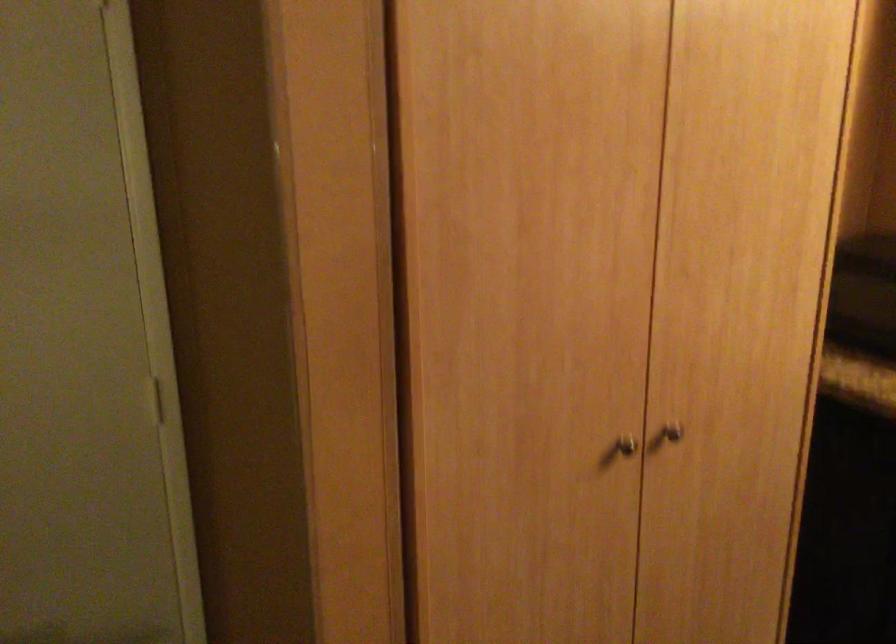
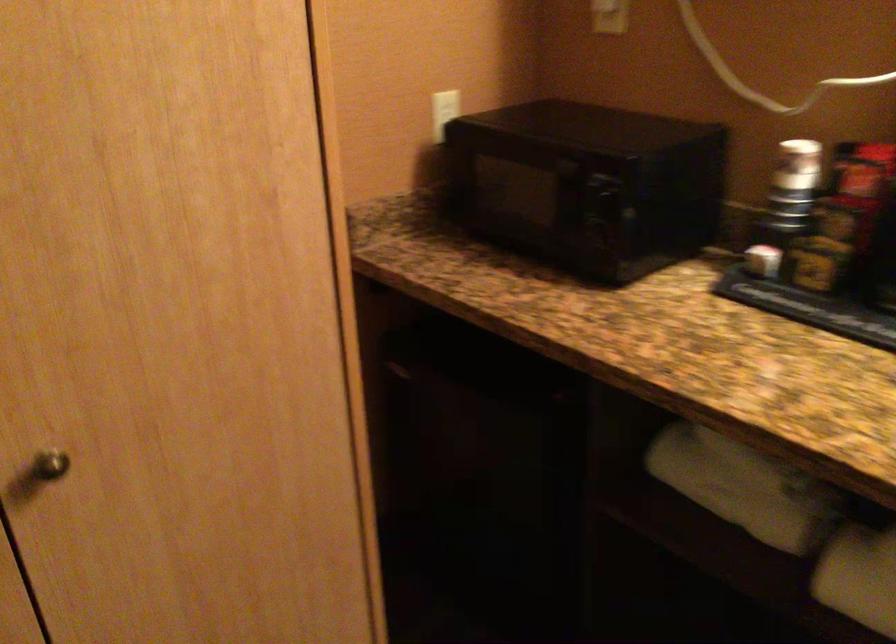
Find the pixel in the second image that matches the point at 651,440 in the first image.

(49, 465)